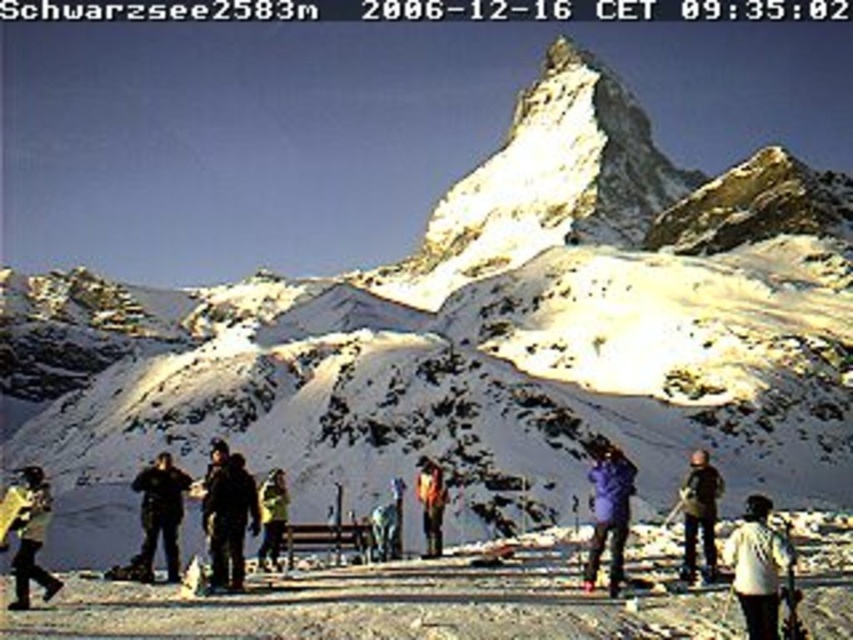
Can you confirm if white matte jacket at lower right is wider than matte black jacket at lower left?

Incorrect, white matte jacket at lower right's width does not surpass matte black jacket at lower left's.

Between white matte jacket at lower right and matte black jacket at lower left, which one has more height?

matte black jacket at lower left is taller.

Is point (737, 529) closer to camera compared to point (32, 554)?

No, (737, 529) is further to viewer.

You are a GUI agent. You are given a task and a screenshot of the screen. Output one action in this format:
    pyautogui.click(x=<x>, y=<y>)
    Task: Click on the white matte jacket at lower right
    
    Given the screenshot: What is the action you would take?
    pyautogui.click(x=758, y=566)

Is dark gray jacket at center wider than matte black jacket at lower left?

In fact, dark gray jacket at center might be narrower than matte black jacket at lower left.

Does dark gray jacket at center have a greater height compared to matte black jacket at lower left?

No.

Who is more forward, (257, 502) or (38, 516)?

Point (38, 516) is in front.

Image resolution: width=853 pixels, height=640 pixels. I want to click on dark gray jacket at center, so click(229, 520).

Does dark gray jacket at lower left have a greater width compared to dark brown jacket at center?

Yes, dark gray jacket at lower left is wider than dark brown jacket at center.

Can you confirm if dark gray jacket at lower left is thinner than dark brown jacket at center?

No.

The image size is (853, 640). I want to click on dark gray jacket at lower left, so click(x=160, y=513).